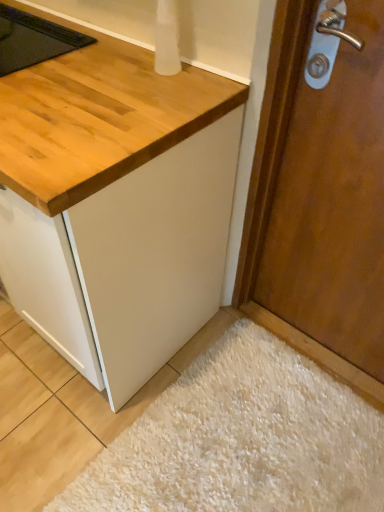
Question: Considering the positions of white shaggy rug at lower right and wooden door at right in the image, is white shaggy rug at lower right wider or thinner than wooden door at right?

Choices:
 (A) wide
 (B) thin

Answer: (A)

Question: From a real-world perspective, relative to wooden door at right, is white shaggy rug at lower right vertically above or below?

Choices:
 (A) below
 (B) above

Answer: (A)

Question: From their relative heights in the image, would you say white shaggy rug at lower right is taller or shorter than wooden door at right?

Choices:
 (A) short
 (B) tall

Answer: (A)

Question: Is wooden door at right inside the boundaries of white shaggy rug at lower right, or outside?

Choices:
 (A) inside
 (B) outside

Answer: (B)

Question: Does point (317, 170) appear closer or farther from the camera than point (241, 499)?

Choices:
 (A) closer
 (B) farther

Answer: (A)

Question: From the image's perspective, relative to white shaggy rug at lower right, is wooden door at right above or below?

Choices:
 (A) above
 (B) below

Answer: (A)

Question: Looking at the image, does wooden door at right seem bigger or smaller compared to white shaggy rug at lower right?

Choices:
 (A) big
 (B) small

Answer: (A)